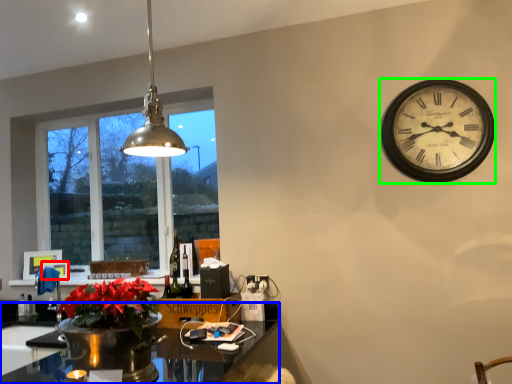
Question: Considering the real-world distances, which object is farthest from picture frame (highlighted by a red box)? desk (highlighted by a blue box) or wall clock (highlighted by a green box)?

Choices:
 (A) desk
 (B) wall clock

Answer: (B)